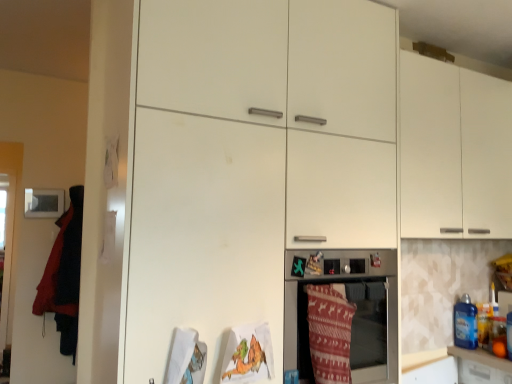
Question: In terms of width, does matte white oven at center look wider or thinner when compared to velvet red blanket at left, positioned as the second blanket in front-to-back order?

Choices:
 (A) thin
 (B) wide

Answer: (B)

Question: From their relative heights in the image, would you say matte white oven at center is taller or shorter than velvet red blanket at left, positioned as the second blanket in front-to-back order?

Choices:
 (A) tall
 (B) short

Answer: (B)

Question: Which is nearer to the white matte cabinet at upper right?

Choices:
 (A) velvet red blanket at left, positioned as the second blanket in front-to-back order
 (B) blue plastic bottle at right
 (C) knitted woolen blanket at lower center, placed as the second blanket when sorted from left to right
 (D) matte white oven at center

Answer: (D)

Question: Estimate the real-world distances between objects in this image. Which object is farther from the matte white oven at center?

Choices:
 (A) velvet red blanket at left, positioned as the second blanket in front-to-back order
 (B) white matte cabinet at upper right
 (C) knitted woolen blanket at lower center, placed as the 1th blanket when sorted from front to back
 (D) blue plastic bottle at right

Answer: (A)